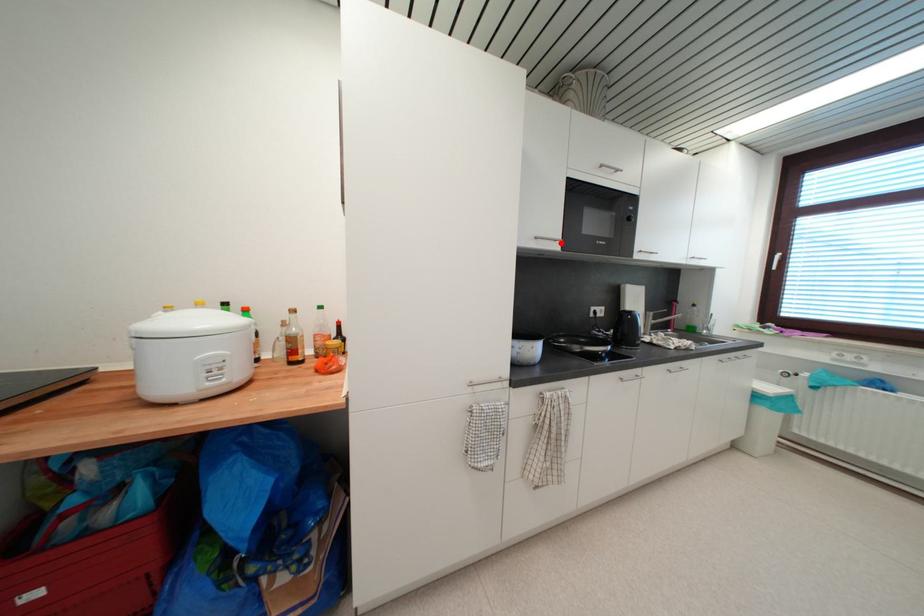
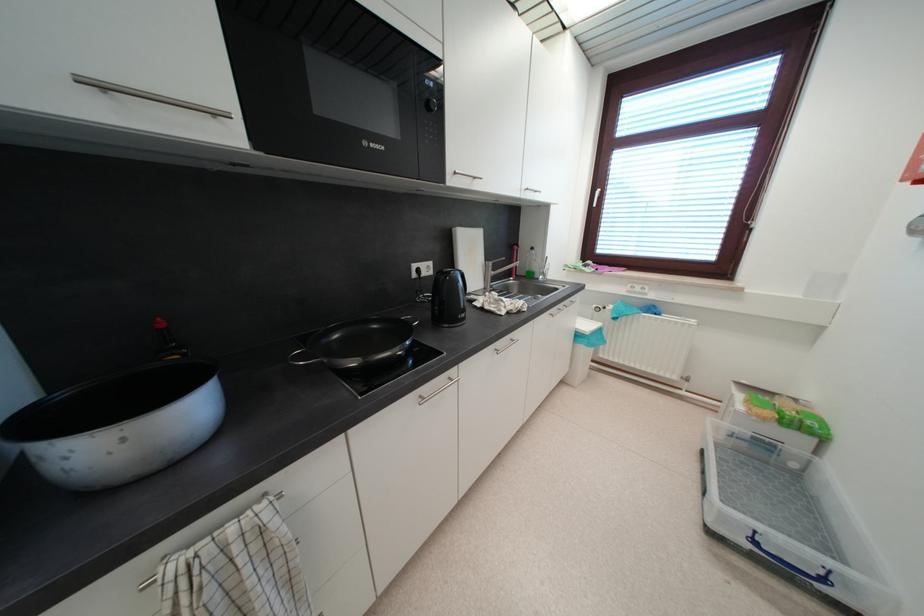
The point at the highlighted location is marked in the first image. Where is the corresponding point in the second image?

(220, 116)